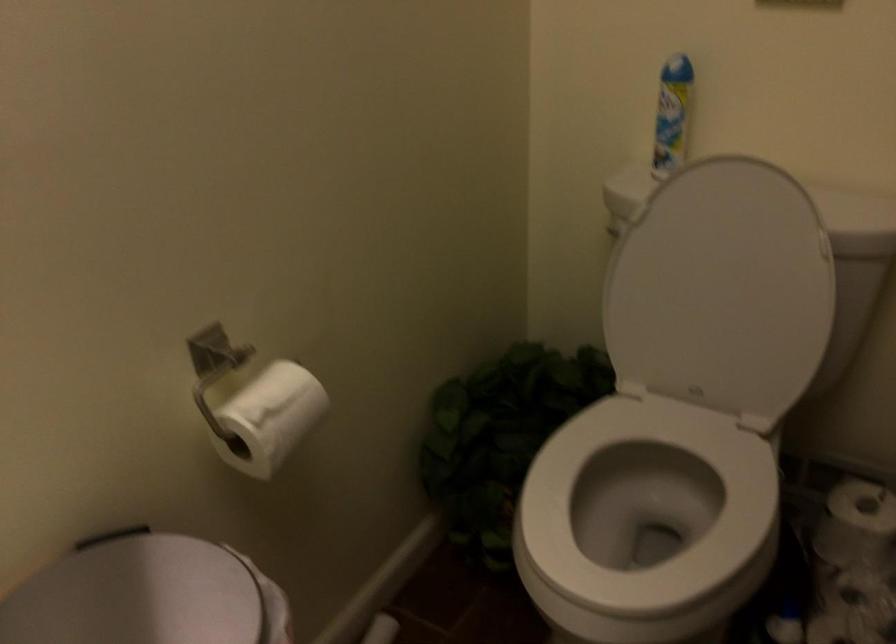
At what (x,y) coordinates should I click in order to perform the action: click on white toilet lid. Please return your answer as a coordinate pair (x, y). The image size is (896, 644). Looking at the image, I should click on (721, 289).